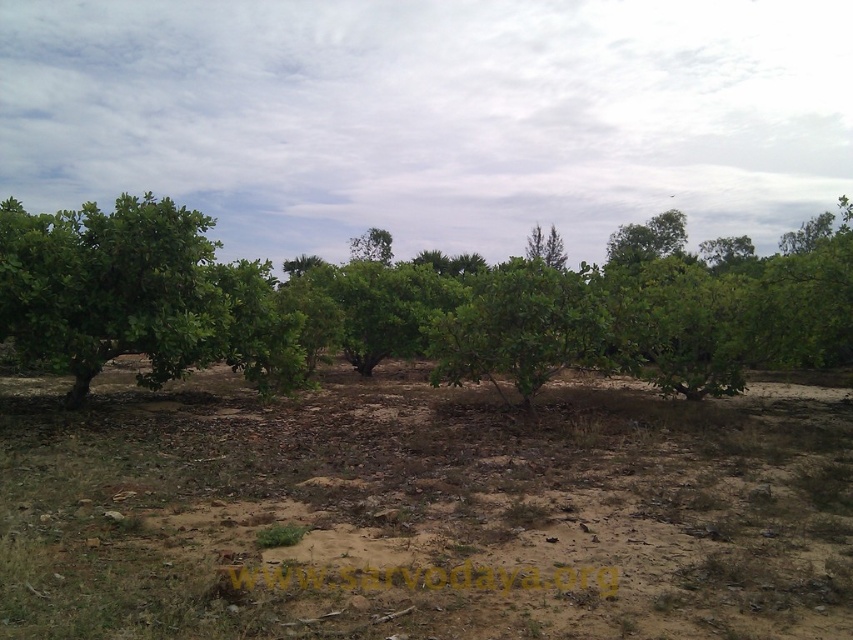
Question: Which point is farther to the camera?

Choices:
 (A) green leafy tree at upper right
 (B) green leafy tree at left
 (C) green leafy tree at center
 (D) brown soil at center

Answer: (A)

Question: Is green leafy tree at center to the left of green leafy tree at upper right from the viewer's perspective?

Choices:
 (A) no
 (B) yes

Answer: (B)

Question: Can you confirm if green leafy tree at left is bigger than green leafy tree at upper right?

Choices:
 (A) no
 (B) yes

Answer: (A)

Question: Which point is closer to the camera?

Choices:
 (A) (177, 340)
 (B) (635, 259)

Answer: (A)

Question: Among these objects, which one is farthest from the camera?

Choices:
 (A) green leafy tree at center
 (B) green leafy tree at left

Answer: (A)

Question: Does brown soil at center have a greater width compared to green leafy tree at left?

Choices:
 (A) yes
 (B) no

Answer: (A)